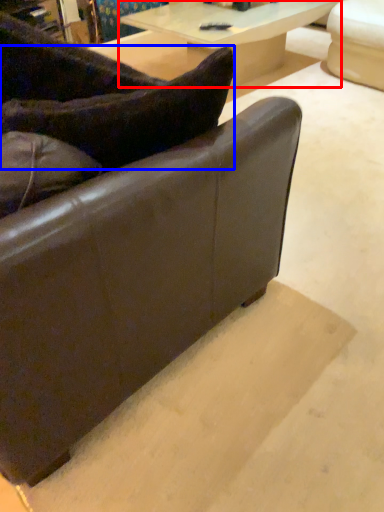
Question: Which object appears farthest to the camera in this image, table (highlighted by a red box) or pillow (highlighted by a blue box)?

Choices:
 (A) table
 (B) pillow

Answer: (A)